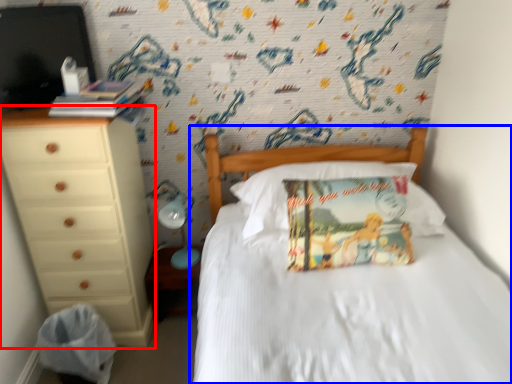
Question: Which point is closer to the camera, chest of drawers (highlighted by a red box) or bed (highlighted by a blue box)?

Choices:
 (A) chest of drawers
 (B) bed

Answer: (B)